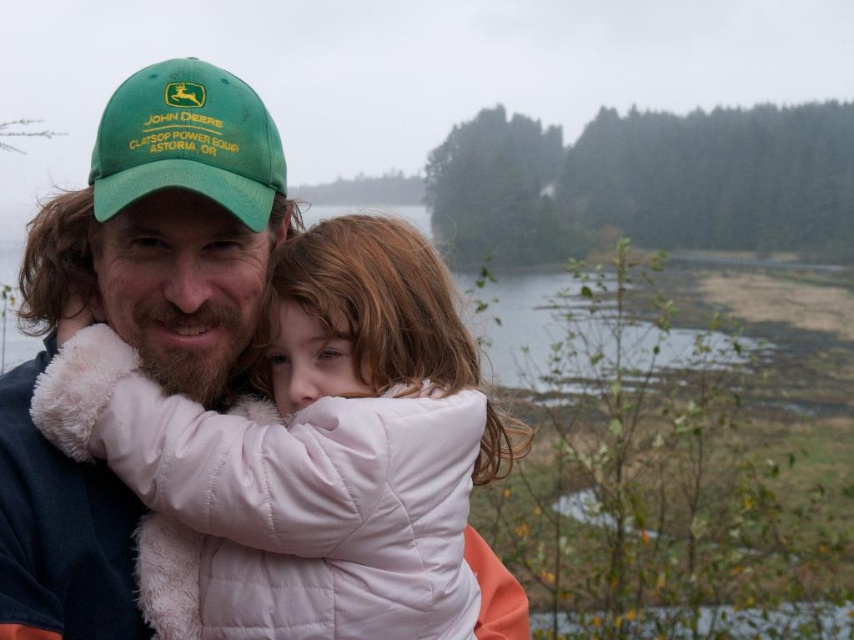
You are a photographer trying to capture a closeup of the white puffy jacket at center and the green fabric baseball cap at upper left. Which object should you focus on first to ensure both are in focus?

The white puffy jacket at center is closer to the viewer than the green fabric baseball cap at upper left, so focus on the white puffy jacket at center first to ensure both are in focus.

You are standing in the scene and want to walk from point [230,180] to point [295,445]. Which direction should you face to move towards the closer point?

Point [295,445] is closer to the viewer than point [230,180]. To move towards the closer point, you should face towards the direction of point [295,445].